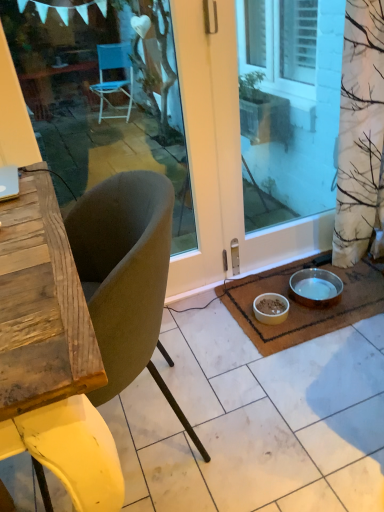
Locate an element on the screen. Image resolution: width=384 pixels, height=512 pixels. free point in front of transparent glass door at center, the first window screen positioned from the right is located at coordinates (301, 274).